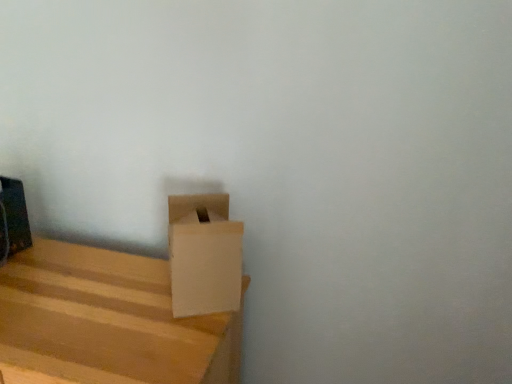
Image resolution: width=512 pixels, height=384 pixels. I want to click on light brown wood box at lower left, so click(108, 321).

What do you see at coordinates (108, 321) in the screenshot? I see `light brown wood box at lower left` at bounding box center [108, 321].

Locate an element on the screen. The width and height of the screenshot is (512, 384). white cardboard box at lower left is located at coordinates (204, 255).

The image size is (512, 384). What do you see at coordinates (204, 255) in the screenshot?
I see `white cardboard box at lower left` at bounding box center [204, 255].

Locate an element on the screen. This screenshot has width=512, height=384. light brown wood box at lower left is located at coordinates (108, 321).

Which object is positioned more to the right, light brown wood box at lower left or white cardboard box at lower left?

From the viewer's perspective, white cardboard box at lower left appears more on the right side.

Is the depth of light brown wood box at lower left greater than that of white cardboard box at lower left?

No, light brown wood box at lower left is in front of white cardboard box at lower left.

Between point (209, 328) and point (194, 294), which one is positioned in front?

The point (209, 328) is closer.

From the image's perspective, is light brown wood box at lower left above or below white cardboard box at lower left?

Based on their image positions, light brown wood box at lower left is located beneath white cardboard box at lower left.

From a real-world perspective, is light brown wood box at lower left beneath white cardboard box at lower left?

Yes, from a real-world perspective, light brown wood box at lower left is below white cardboard box at lower left.

Does light brown wood box at lower left have a greater width compared to white cardboard box at lower left?

Yes.

Can you confirm if light brown wood box at lower left is taller than white cardboard box at lower left?

Yes, light brown wood box at lower left is taller than white cardboard box at lower left.

Considering the sizes of light brown wood box at lower left and white cardboard box at lower left in the image, is light brown wood box at lower left bigger or smaller than white cardboard box at lower left?

Considering their sizes, light brown wood box at lower left takes up more space than white cardboard box at lower left.

Is light brown wood box at lower left not within white cardboard box at lower left?

Yes.

Is light brown wood box at lower left positioned far away from white cardboard box at lower left?

No, light brown wood box at lower left is not far away from white cardboard box at lower left.

Is light brown wood box at lower left oriented towards white cardboard box at lower left?

No.

What's the angular difference between light brown wood box at lower left and white cardboard box at lower left's facing directions?

They differ by 63.9 degrees in their facing directions.

Locate an element on the screen. The height and width of the screenshot is (384, 512). cardboard box that appears behind the light brown wood box at lower left is located at coordinates (204, 255).

Which is more to the right, white cardboard box at lower left or light brown wood box at lower left?

white cardboard box at lower left.

Relative to light brown wood box at lower left, is white cardboard box at lower left in front or behind?

In the image, white cardboard box at lower left appears behind light brown wood box at lower left.

Considering the positions of points (198, 234) and (37, 260), is point (198, 234) farther from camera compared to point (37, 260)?

That is False.

From the image's perspective, which one is positioned higher, white cardboard box at lower left or light brown wood box at lower left?

white cardboard box at lower left, from the image's perspective.

From a real-world perspective, who is located higher, white cardboard box at lower left or light brown wood box at lower left?

white cardboard box at lower left is physically above.

Between white cardboard box at lower left and light brown wood box at lower left, which one has smaller width?

Thinner between the two is white cardboard box at lower left.

Considering the sizes of objects white cardboard box at lower left and light brown wood box at lower left in the image provided, who is shorter, white cardboard box at lower left or light brown wood box at lower left?

white cardboard box at lower left.

In terms of size, does white cardboard box at lower left appear bigger or smaller than light brown wood box at lower left?

Considering their sizes, white cardboard box at lower left takes up less space than light brown wood box at lower left.

Is white cardboard box at lower left surrounding light brown wood box at lower left?

No, light brown wood box at lower left is not a part of white cardboard box at lower left.

Are white cardboard box at lower left and light brown wood box at lower left far apart?

No, there isn't a large distance between white cardboard box at lower left and light brown wood box at lower left.

Does white cardboard box at lower left turn towards light brown wood box at lower left?

No, white cardboard box at lower left is not aimed at light brown wood box at lower left.

How many degrees apart are the facing directions of white cardboard box at lower left and light brown wood box at lower left?

The angular difference between white cardboard box at lower left and light brown wood box at lower left is 63.9 degrees.

Find the location of a particular element. furniture that is under the white cardboard box at lower left (from a real-world perspective) is located at coordinates (108, 321).

Identify the location of furniture on the left of white cardboard box at lower left. This screenshot has height=384, width=512. (108, 321).

Find the location of `furniture located underneath the white cardboard box at lower left (from a real-world perspective)`. furniture located underneath the white cardboard box at lower left (from a real-world perspective) is located at coordinates (108, 321).